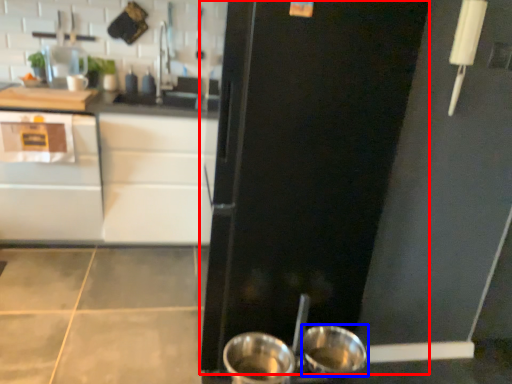
Question: Among these objects, which one is nearest to the camera, door (highlighted by a red box) or basin (highlighted by a blue box)?

Choices:
 (A) door
 (B) basin

Answer: (A)